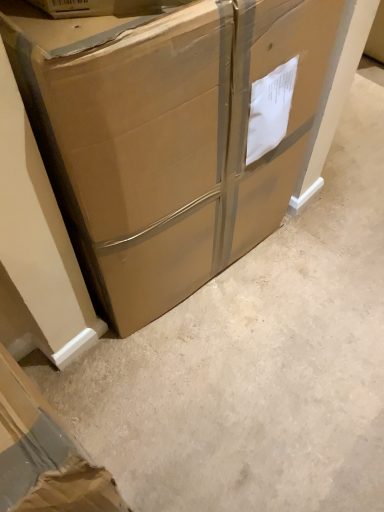
This screenshot has width=384, height=512. Describe the element at coordinates (169, 135) in the screenshot. I see `brown cardboard box at center` at that location.

The height and width of the screenshot is (512, 384). I want to click on brown cardboard box at center, so click(169, 135).

This screenshot has width=384, height=512. In order to click on brown cardboard box at center in this screenshot , I will do `click(169, 135)`.